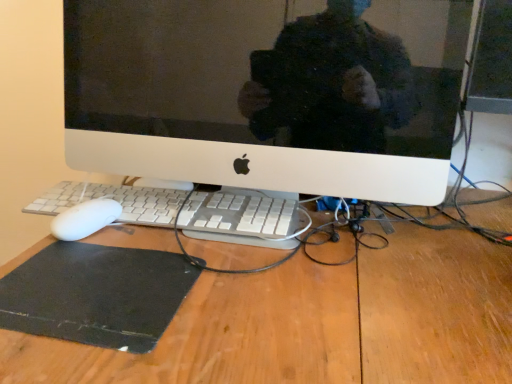
Where is `free point in front of white plastic keyboard at center`? free point in front of white plastic keyboard at center is located at coordinates (216, 304).